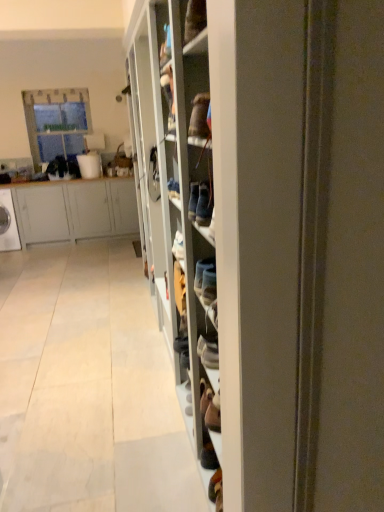
Question: Can you confirm if wooden shoe rack at center is thinner than white glossy washing machine at left?

Choices:
 (A) yes
 (B) no

Answer: (A)

Question: Is wooden shoe rack at center at the left side of white glossy washing machine at left?

Choices:
 (A) yes
 (B) no

Answer: (B)

Question: Does wooden shoe rack at center have a smaller size compared to white glossy washing machine at left?

Choices:
 (A) yes
 (B) no

Answer: (B)

Question: Is wooden shoe rack at center not close to white glossy washing machine at left?

Choices:
 (A) yes
 (B) no

Answer: (A)

Question: Is wooden shoe rack at center looking in the opposite direction of white glossy washing machine at left?

Choices:
 (A) yes
 (B) no

Answer: (B)

Question: Could you tell me if wooden shoe rack at center is facing white glossy washing machine at left?

Choices:
 (A) no
 (B) yes

Answer: (A)

Question: Considering the relative positions of clear glass window at upper left and matte gray cabinet at left in the image provided, is clear glass window at upper left to the right of matte gray cabinet at left from the viewer's perspective?

Choices:
 (A) yes
 (B) no

Answer: (B)

Question: From the image's perspective, is clear glass window at upper left on top of matte gray cabinet at left?

Choices:
 (A) yes
 (B) no

Answer: (A)

Question: Does clear glass window at upper left have a smaller size compared to matte gray cabinet at left?

Choices:
 (A) no
 (B) yes

Answer: (B)

Question: From the image's perspective, would you say clear glass window at upper left is shown under matte gray cabinet at left?

Choices:
 (A) yes
 (B) no

Answer: (B)

Question: Could matte gray cabinet at left be considered to be inside clear glass window at upper left?

Choices:
 (A) no
 (B) yes

Answer: (A)

Question: Could you tell me if clear glass window at upper left is facing matte gray cabinet at left?

Choices:
 (A) no
 (B) yes

Answer: (A)

Question: Is clear glass window at upper left at the back of matte gray cabinet at left?

Choices:
 (A) no
 (B) yes

Answer: (A)